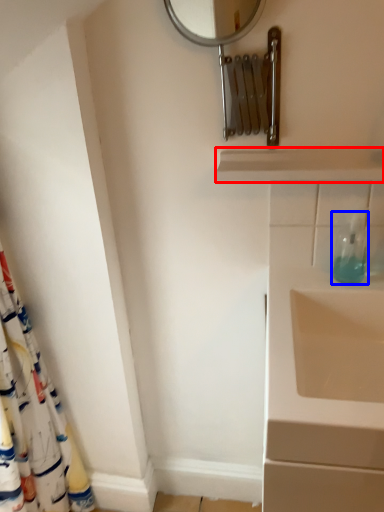
Question: Which of the following is the closest to the observer, balustrade (highlighted by a red box) or soap dispenser (highlighted by a blue box)?

Choices:
 (A) balustrade
 (B) soap dispenser

Answer: (A)